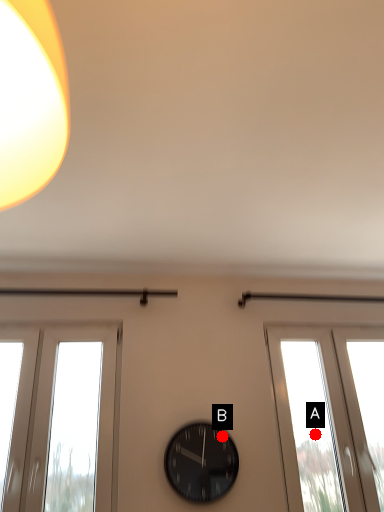
Question: Two points are circled on the image, labeled by A and B beside each circle. Which point is farther to the camera?

Choices:
 (A) A is further
 (B) B is further

Answer: (A)